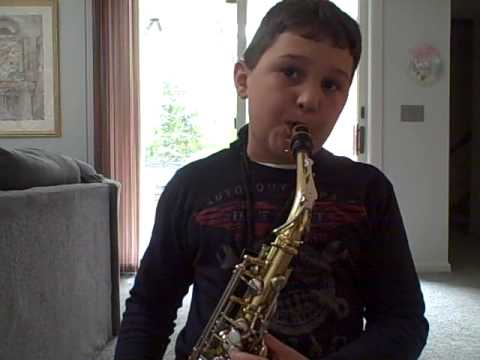
This screenshot has height=360, width=480. I want to click on switches, so click(403, 123).